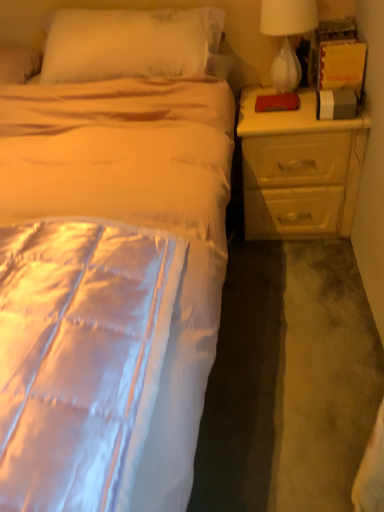
Question: Is yellow matte nightstand at right wider than silky white bed at center?

Choices:
 (A) no
 (B) yes

Answer: (A)

Question: From the image's perspective, is yellow matte nightstand at right on silky white bed at center?

Choices:
 (A) yes
 (B) no

Answer: (A)

Question: Is yellow matte nightstand at right to the left of silky white bed at center from the viewer's perspective?

Choices:
 (A) no
 (B) yes

Answer: (A)

Question: Is yellow matte nightstand at right smaller than silky white bed at center?

Choices:
 (A) yes
 (B) no

Answer: (A)

Question: Is yellow matte nightstand at right oriented away from silky white bed at center?

Choices:
 (A) no
 (B) yes

Answer: (B)

Question: Is yellow matte nightstand at right far from silky white bed at center?

Choices:
 (A) no
 (B) yes

Answer: (A)

Question: Is white glass lamp at upper right shorter than silky white bed at center?

Choices:
 (A) no
 (B) yes

Answer: (B)

Question: Can you confirm if white glass lamp at upper right is bigger than silky white bed at center?

Choices:
 (A) no
 (B) yes

Answer: (A)

Question: Would you say white glass lamp at upper right is a long distance from silky white bed at center?

Choices:
 (A) yes
 (B) no

Answer: (B)

Question: Does white glass lamp at upper right contain silky white bed at center?

Choices:
 (A) yes
 (B) no

Answer: (B)

Question: Does white glass lamp at upper right come in front of silky white bed at center?

Choices:
 (A) yes
 (B) no

Answer: (B)

Question: Is white glass lamp at upper right placed right next to silky white bed at center?

Choices:
 (A) yes
 (B) no

Answer: (B)

Question: Can you confirm if silky white bed at center is shorter than white glass lamp at upper right?

Choices:
 (A) yes
 (B) no

Answer: (B)